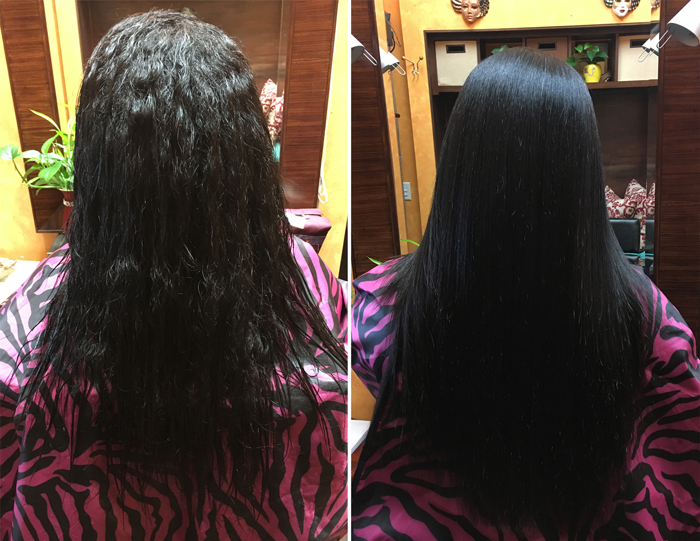
Find the location of a particular element. wall is located at coordinates (531, 13), (332, 180).